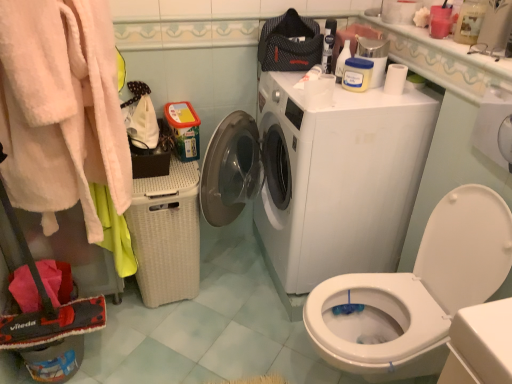
Locate an element on the screen. The image size is (512, 384). free space that is in between white matte toilet paper at upper right, arranged as the 2th toilet paper when viewed from the back, and white matte toilet paper at upper right, arranged as the second toilet paper when viewed from the front is located at coordinates (356, 98).